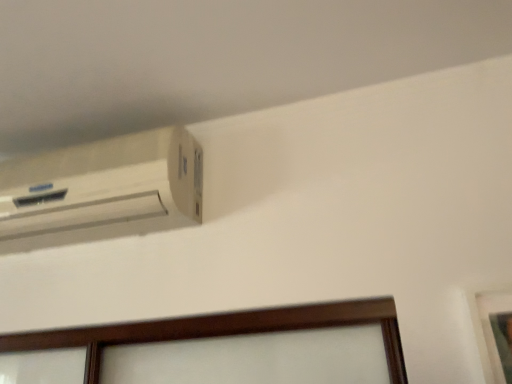
Question: Relative to white matte air conditioning at upper left, is wooden picture frame at lower right in front or behind?

Choices:
 (A) behind
 (B) front

Answer: (B)

Question: From the image's perspective, is wooden picture frame at lower right located above or below white matte air conditioning at upper left?

Choices:
 (A) above
 (B) below

Answer: (B)

Question: Looking at the image, does wooden picture frame at lower right seem bigger or smaller compared to white matte air conditioning at upper left?

Choices:
 (A) small
 (B) big

Answer: (A)

Question: Is point (189, 211) closer or farther from the camera than point (495, 349)?

Choices:
 (A) farther
 (B) closer

Answer: (A)

Question: Do you think white matte air conditioning at upper left is within wooden picture frame at lower right, or outside of it?

Choices:
 (A) inside
 (B) outside

Answer: (B)

Question: Visually, is white matte air conditioning at upper left positioned to the left or to the right of wooden picture frame at lower right?

Choices:
 (A) left
 (B) right

Answer: (A)

Question: Is white matte air conditioning at upper left taller or shorter than wooden picture frame at lower right?

Choices:
 (A) tall
 (B) short

Answer: (B)